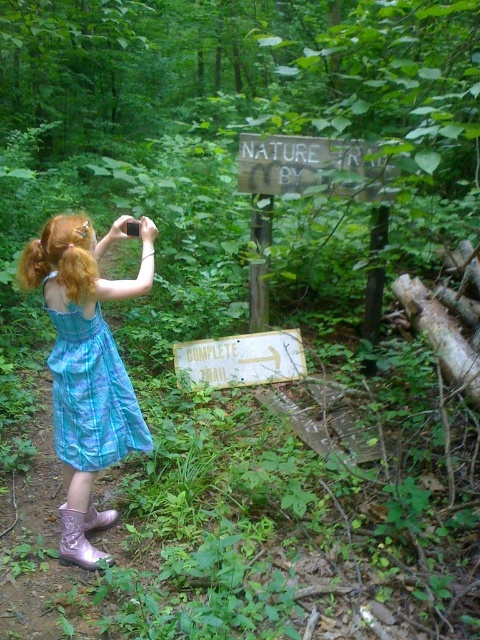
Question: Among these points, which one is nearest to the camera?

Choices:
 (A) (202, 376)
 (B) (113, 451)
 (C) (67, 544)
 (D) (72, 294)

Answer: (D)

Question: From the image, what is the correct spatial relationship of blue plaid dress at left in relation to blonde silky hair at left?

Choices:
 (A) below
 (B) above

Answer: (A)

Question: Which of the following is the closest to the observer?

Choices:
 (A) (79, 268)
 (B) (299, 156)

Answer: (A)

Question: Is shiny blue dress at center to the left of white wooden sign at center from the viewer's perspective?

Choices:
 (A) yes
 (B) no

Answer: (A)

Question: Which point is farther to the camera?

Choices:
 (A) blonde silky hair at left
 (B) weathered wood sign at upper center
 (C) pink rubber boot at lower left
 (D) shiny blue dress at center

Answer: (C)

Question: Does shiny blue dress at center appear on the left side of pink rubber boot at lower left?

Choices:
 (A) yes
 (B) no

Answer: (B)